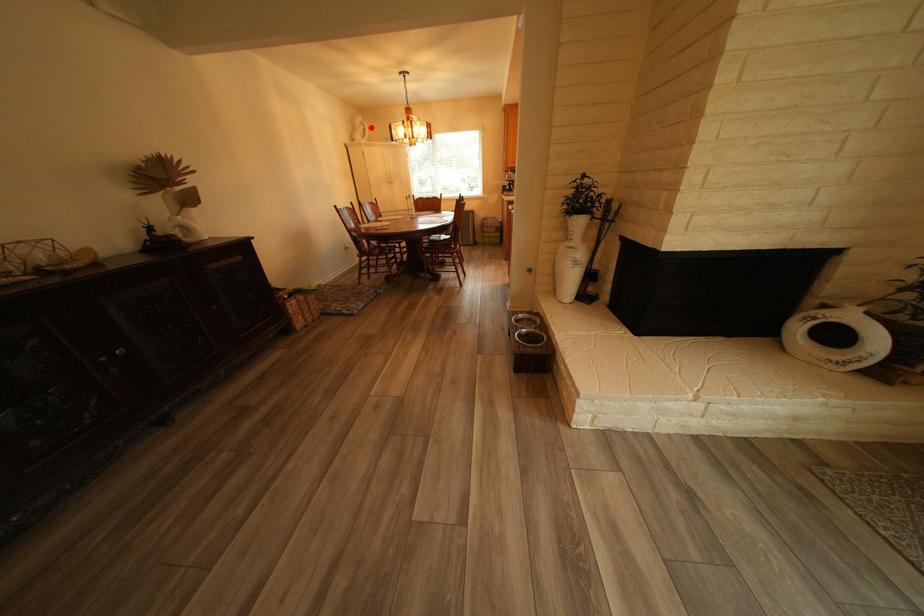
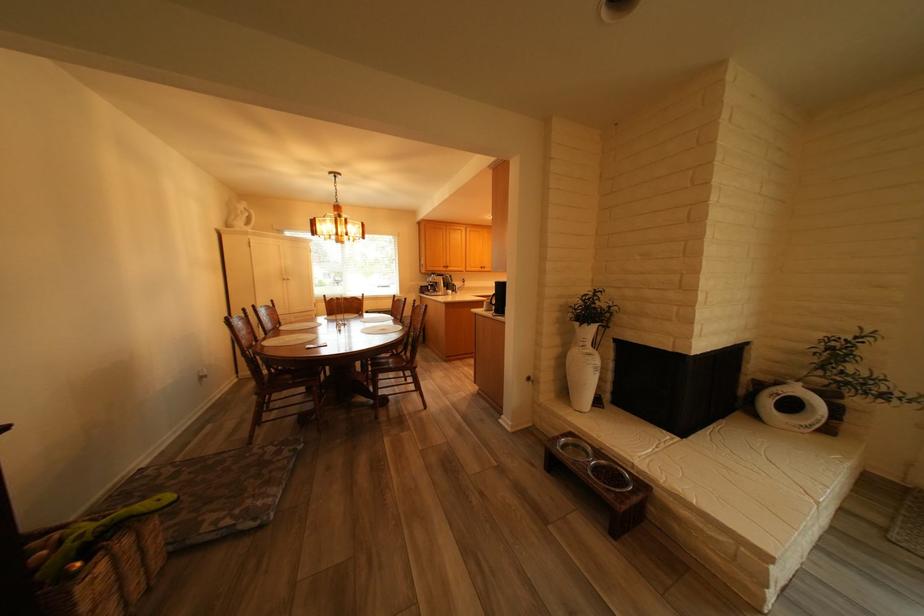
Find the pixel in the second image that matches the highlighted location in the first image.

(253, 213)